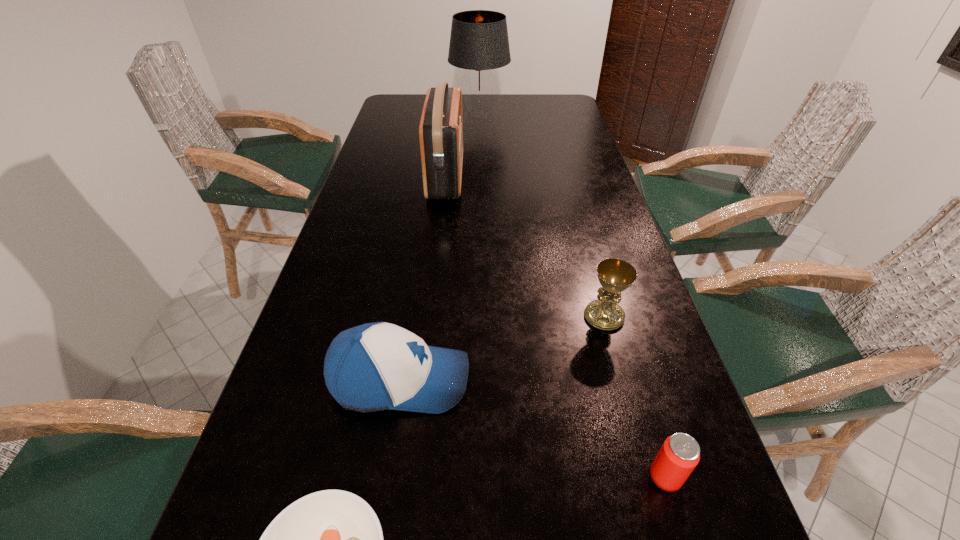
Locate an element on the screen. free space at the far left corner is located at coordinates [x=419, y=111].

This screenshot has width=960, height=540. Identify the location of free spot between the baseball cap and the fourth nearest object. (502, 348).

In order to click on free point between the lampshade and the fifth farthest object in this screenshot , I will do 572,295.

I want to click on vacant point located between the chalice and the farthest object, so click(x=541, y=215).

The width and height of the screenshot is (960, 540). Identify the location of free space between the fourth nearest object and the farthest object. (541, 215).

Where is `vacant space that's between the fifth farthest object and the radio receiver`? vacant space that's between the fifth farthest object and the radio receiver is located at coordinates (556, 327).

Select which object appears as the third closest to the fifth nearest object. Please provide its 2D coordinates. Your answer should be formatted as a tuple, i.e. [(x, y)], where the tuple contains the x and y coordinates of a point satisfying the conditions above.

[(377, 366)]

Locate which object ranks fifth in proximity to the fourth farthest object. Please provide its 2D coordinates. Your answer should be formatted as a tuple, i.e. [(x, y)], where the tuple contains the x and y coordinates of a point satisfying the conditions above.

[(479, 44)]

Find the location of a particular element. The image size is (960, 540). free space that satisfies the following two spatial constraints: 1. on the front side of the beer can; 2. on the right side of the fourth nearest object is located at coordinates (648, 477).

You are a GUI agent. You are given a task and a screenshot of the screen. Output one action in this format:
    pyautogui.click(x=<x>, y=<y>)
    Task: Click on the vacant region that satisfies the following two spatial constraints: 1. on the front-facing side of the third farthest object; 2. on the left side of the second farthest object
    The image size is (960, 540).
    Given the screenshot: What is the action you would take?
    pyautogui.click(x=431, y=316)